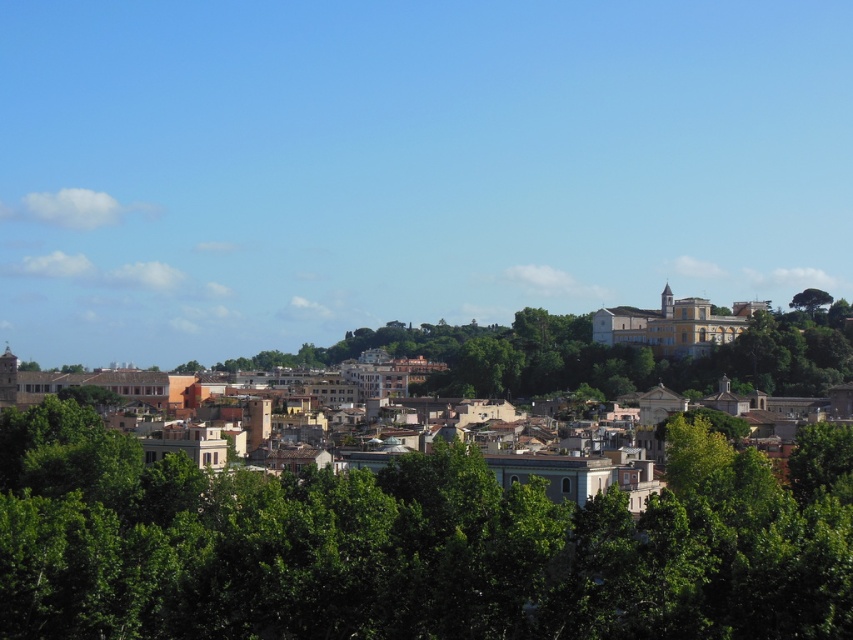
You are standing at the center of the city park and see the green leafy tree at center. If you walk straight ahead, will you reach the hill with the building on top before the tree?

The green leafy tree at center is located at point (397, 548), which is closer to the observer than the hill in the background. Therefore, you will reach the tree before the hill.

From the picture: You are standing in the cityscape scene and want to determine the relative positions of two points. Which point is closer to you, point 1 at coordinates point (149, 548) or point 2 at coordinates point (805, 301)?

Point (149, 548) is closer to the camera than point (805, 301), so point 1 is closer to you.

You are standing at the base of the hill in the cityscape image. You see two points marked on the image. The first point is at coordinate point (691, 396) and the second point is at coordinate point (817, 289). Which point is closer to you?

Point (691, 396) is in front of point (817, 289), so it is closer to you.